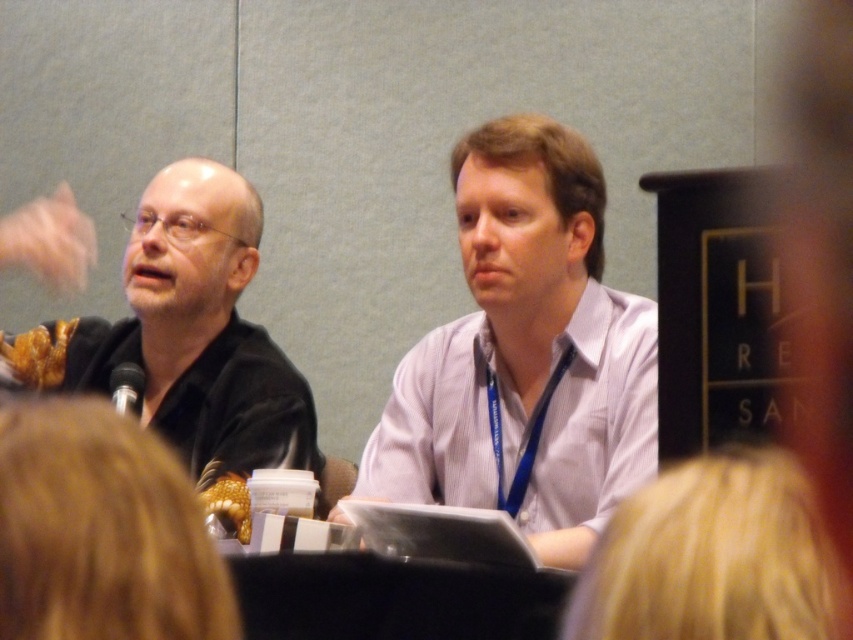
Looking at this image, is matte purple shirt at center positioned at the back of black matte shirt at left?

No.

Can you confirm if matte purple shirt at center is positioned below black matte shirt at left?

No.

Is point (613, 481) in front of point (184, 234)?

Yes, point (613, 481) is in front of point (184, 234).

You are a GUI agent. You are given a task and a screenshot of the screen. Output one action in this format:
    pyautogui.click(x=<x>, y=<y>)
    Task: Click on the matte purple shirt at center
    
    Given the screenshot: What is the action you would take?
    pyautogui.click(x=526, y=355)